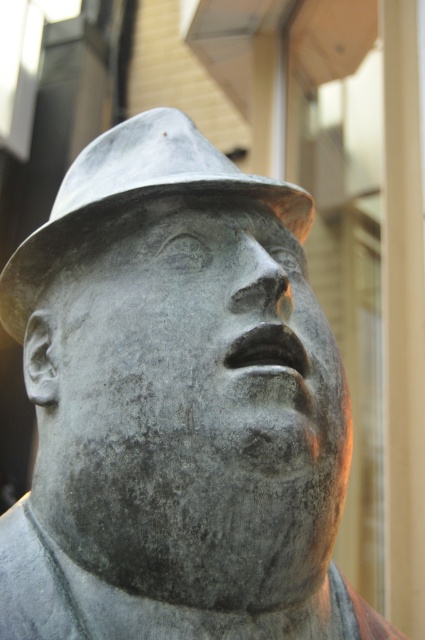
You are standing in front of a bronze statue of a man with a tilted hat. There is a gray stone face at center at point (198, 355). Is the gray stone face at center part of the statue or the background?

The gray stone face at center at point (198, 355) is part of the statue, as it is described as being located at the center of the image, which aligns with the main subject of the statue.

You are an art conservator working on a sculpture. You need to place a protective cover over both the gray stone face at center and the bronze textured fedora at center. The cover has a 5 inch diameter opening. Will the opening be large enough to cover both objects without moving them?

The distance between the gray stone face at center and the bronze textured fedora at center is 4.99 inches, which is just under the 5 inch diameter of the cover. Therefore, the opening should be large enough to cover both objects without needing to move them.

You are a sculptor who wants to place a small plaque between the gray stone face at center and the edge of the statue base. The plaque requires 1 meter of space. Is there enough space?

The distance between the gray stone face at center and the edge of the statue base is 1.15 meters, so yes, there is enough space for the plaque since it requires only 1 meter.